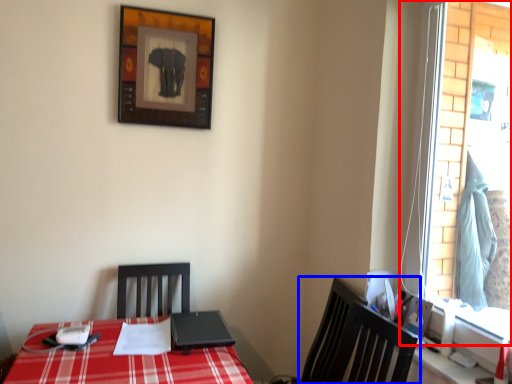
Question: Among these objects, which one is farthest to the camera, window (highlighted by a red box) or chair (highlighted by a blue box)?

Choices:
 (A) window
 (B) chair

Answer: (B)